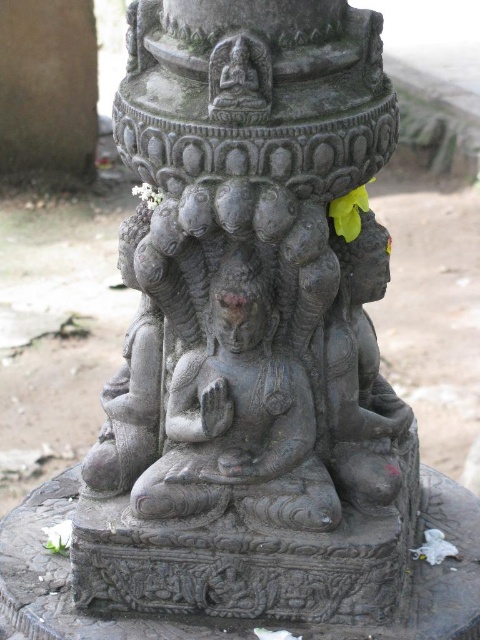
Question: Which point appears farthest from the camera in this image?

Choices:
 (A) (282, 630)
 (B) (44, 532)

Answer: (B)

Question: In this image, where is white paper flower at lower left located relative to white matte flower at center?

Choices:
 (A) below
 (B) above

Answer: (A)

Question: Is black stone statue at center to the left of white paper flower at lower center from the viewer's perspective?

Choices:
 (A) yes
 (B) no

Answer: (A)

Question: Considering the real-world distances, which object is closest to the white matte flower at center?

Choices:
 (A) white paper flower at lower left
 (B) black stone statue at center

Answer: (B)

Question: Is green leafy plant at upper center below white paper flower at lower left?

Choices:
 (A) no
 (B) yes

Answer: (A)

Question: Based on their relative distances, which object is farther from the white paper flower at lower left?

Choices:
 (A) white paper flower at lower center
 (B) black stone statue at center
 (C) green leafy plant at upper center
 (D) white matte flower at center

Answer: (C)